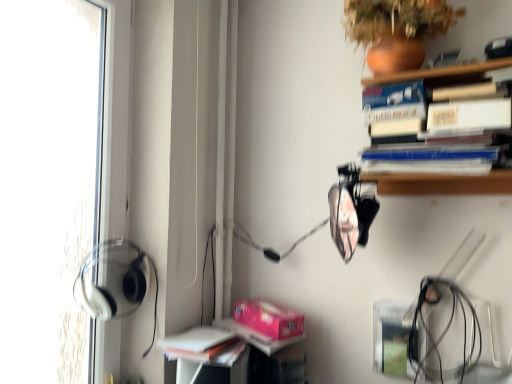
Looking at this image, in order to face pink matte paperback book at lower center, should I rotate leftwards or rightwards?

You should rotate right by 1.331 degrees.

The image size is (512, 384). Describe the element at coordinates (269, 318) in the screenshot. I see `pink matte paperback book at lower center` at that location.

What is the approximate height of white matte book at lower left?

1.79 inches.

Measure the distance between white matte book at lower left and camera.

They are 3.81 feet apart.

Describe the element at coordinates (396, 30) in the screenshot. I see `terracotta clay vase at upper right` at that location.

What are the coordinates of `pink matte paperback book at lower center` in the screenshot? It's located at (269, 318).

Looking at this image, can you confirm if pink matte paperback book at lower center is positioned to the left of terracotta clay vase at upper right?

Correct, you'll find pink matte paperback book at lower center to the left of terracotta clay vase at upper right.

Is pink matte paperback book at lower center aimed at terracotta clay vase at upper right?

No, pink matte paperback book at lower center is not oriented towards terracotta clay vase at upper right.

In the scene shown: Considering the sizes of objects pink matte paperback book at lower center and terracotta clay vase at upper right in the image provided, who is bigger, pink matte paperback book at lower center or terracotta clay vase at upper right?

terracotta clay vase at upper right is bigger.

How many degrees apart are the facing directions of pink matte paperback book at lower center and terracotta clay vase at upper right?

The angular difference between pink matte paperback book at lower center and terracotta clay vase at upper right is 71.2 degrees.

Looking at this image, is terracotta clay vase at upper right completely or partially outside of white matte book at lower left?

terracotta clay vase at upper right lies outside white matte book at lower left's area.

In terms of size, does terracotta clay vase at upper right appear bigger or smaller than white matte book at lower left?

Clearly, terracotta clay vase at upper right is larger in size than white matte book at lower left.

Which point is more forward, (430,36) or (179,354)?

Point (179,354)

Would you say terracotta clay vase at upper right is to the left or to the right of white matte book at lower left in the picture?

terracotta clay vase at upper right is to the right of white matte book at lower left.

Does white matte book at lower left have a greater width compared to terracotta clay vase at upper right?

No, white matte book at lower left is not wider than terracotta clay vase at upper right.

Between point (193, 330) and point (414, 28), which one is positioned behind?

The point (193, 330) is farther from the camera.

Could you tell me if white matte book at lower left is turned towards terracotta clay vase at upper right?

No, white matte book at lower left is not oriented towards terracotta clay vase at upper right.

Considering the relative positions of white matte book at lower left and terracotta clay vase at upper right in the image provided, is white matte book at lower left to the left or to the right of terracotta clay vase at upper right?

white matte book at lower left is to the left of terracotta clay vase at upper right.

From a real-world perspective, relative to white matte book at lower left, is pink matte paperback book at lower center vertically above or below?

pink matte paperback book at lower center is situated higher than white matte book at lower left in the real world.

Is pink matte paperback book at lower center smaller than white matte book at lower left?

Yes.

Does pink matte paperback book at lower center appear on the left side of white matte book at lower left?

Incorrect, pink matte paperback book at lower center is not on the left side of white matte book at lower left.

Considering the relative sizes of pink matte paperback book at lower center and white matte book at lower left in the image provided, is pink matte paperback book at lower center shorter than white matte book at lower left?

Incorrect, the height of pink matte paperback book at lower center does not fall short of that of white matte book at lower left.

Identify the location of plant in front of the pink matte paperback book at lower center. This screenshot has height=384, width=512. [396, 30].

Is point (357, 25) more distant than point (300, 331)?

That is False.

Is terracotta clay vase at upper right with pink matte paperback book at lower center?

terracotta clay vase at upper right and pink matte paperback book at lower center are clearly separated.

Is terracotta clay vase at upper right facing towards pink matte paperback book at lower center?

No, terracotta clay vase at upper right does not turn towards pink matte paperback book at lower center.

Do you think white matte book at lower left is within pink matte paperback book at lower center, or outside of it?

white matte book at lower left is located beyond the bounds of pink matte paperback book at lower center.

Considering the relative sizes of white matte book at lower left and pink matte paperback book at lower center in the image provided, is white matte book at lower left taller than pink matte paperback book at lower center?

No, white matte book at lower left is not taller than pink matte paperback book at lower center.

Does point (170, 340) come in front of point (270, 304)?

Yes.

Find the location of a particular element. The image size is (512, 384). paperback book behind the terracotta clay vase at upper right is located at coordinates (269, 318).

What are the coordinates of `plant located above the white matte book at lower left (from a real-world perspective)` in the screenshot? It's located at pos(396,30).

From the image, which object appears to be farther from pink matte paperback book at lower center, white matte book at lower left or terracotta clay vase at upper right?

Based on the image, terracotta clay vase at upper right appears to be further to pink matte paperback book at lower center.

When comparing their distances from white matte book at lower left, does terracotta clay vase at upper right or pink matte paperback book at lower center seem further?

terracotta clay vase at upper right.

Considering their positions, is pink matte paperback book at lower center positioned further to terracotta clay vase at upper right than white matte book at lower left?

Based on the image, white matte book at lower left appears to be further to terracotta clay vase at upper right.

Based on their spatial positions, is white matte book at lower left or pink matte paperback book at lower center closer to terracotta clay vase at upper right?

pink matte paperback book at lower center is positioned closer to the anchor terracotta clay vase at upper right.

Estimate the real-world distances between objects in this image. Which object is closer to white matte book at lower left, pink matte paperback book at lower center or terracotta clay vase at upper right?

Among the two, pink matte paperback book at lower center is located nearer to white matte book at lower left.

Estimate the real-world distances between objects in this image. Which object is further from pink matte paperback book at lower center, terracotta clay vase at upper right or white matte book at lower left?

terracotta clay vase at upper right.

Identify the location of paperback book between terracotta clay vase at upper right and white matte book at lower left from top to bottom. This screenshot has width=512, height=384. (269, 318).